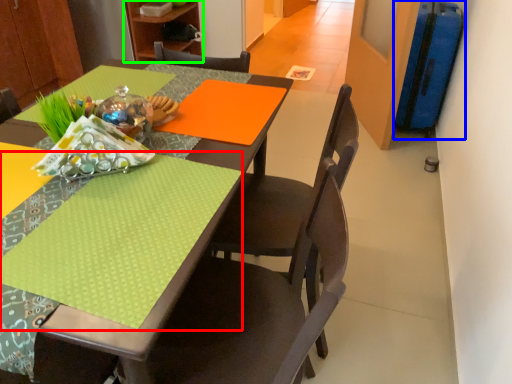
Question: Which object is the farthest from tablecloth (highlighted by a red box)? Choose among these: luggage (highlighted by a blue box) or bookshelf (highlighted by a green box).

Choices:
 (A) luggage
 (B) bookshelf

Answer: (B)